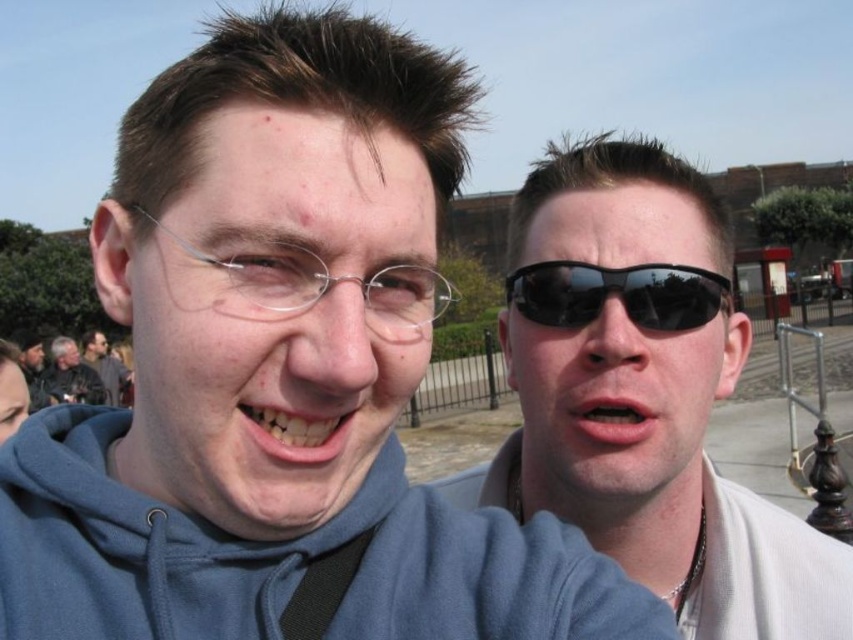
You are standing at the point with coordinates point (561,317) and want to walk to the red structure in the distance. There is an obstacle at point (393,336). Will you have to go around the obstacle to reach your destination?

Point (393,336) is in front of point (561,317), so you will have to go around the obstacle at point (393,336) to reach the red structure in the distance.

You are a photographer trying to capture a closeup of the clear plastic glasses at center. Based on the scene description, where should you position yourself to ensure the glasses are in the center of your photo?

Position yourself so that the clear plastic glasses at center are centered at coordinates approximately point 0.445 on the x axis and 0.374 on the y axis.

You are a photographer trying to capture a portrait of both the matte plastic glasses at center and the matte black jacket at left. Since you want to ensure both are clearly visible, which object should you focus on first to account for their size differences?

The matte plastic glasses at center has a greater height compared to the matte black jacket at left, so you should focus on the matte plastic glasses at center first as it is larger and might require more attention to detail to ensure clarity.